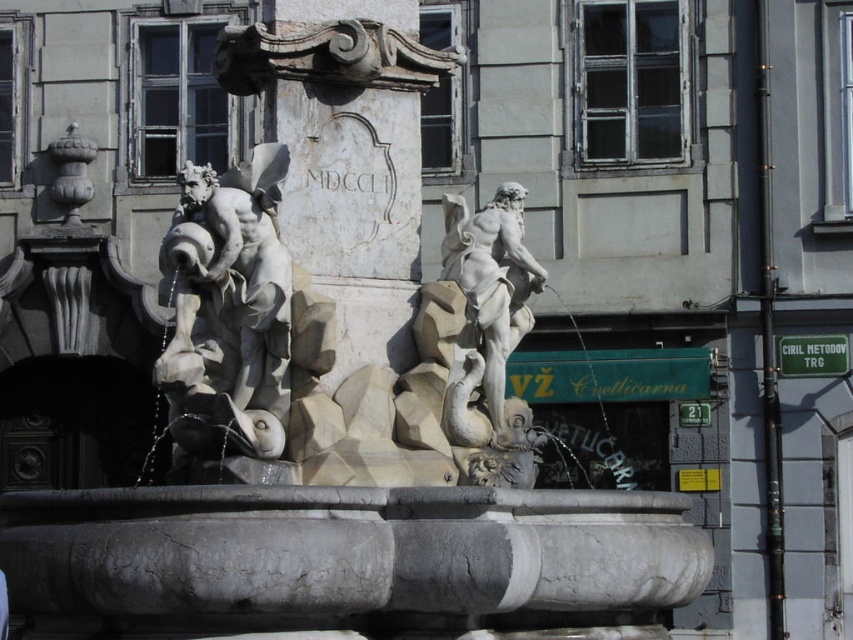
Question: Does white marble statue at left have a greater width compared to white marble statue at center?

Choices:
 (A) yes
 (B) no

Answer: (A)

Question: Which point is closer to the camera?

Choices:
 (A) white marble statue at left
 (B) white marble statue at center

Answer: (A)

Question: Can you confirm if white marble statue at left is positioned to the right of white marble statue at center?

Choices:
 (A) yes
 (B) no

Answer: (B)

Question: Does white marble statue at left appear on the left side of white marble statue at center?

Choices:
 (A) yes
 (B) no

Answer: (A)